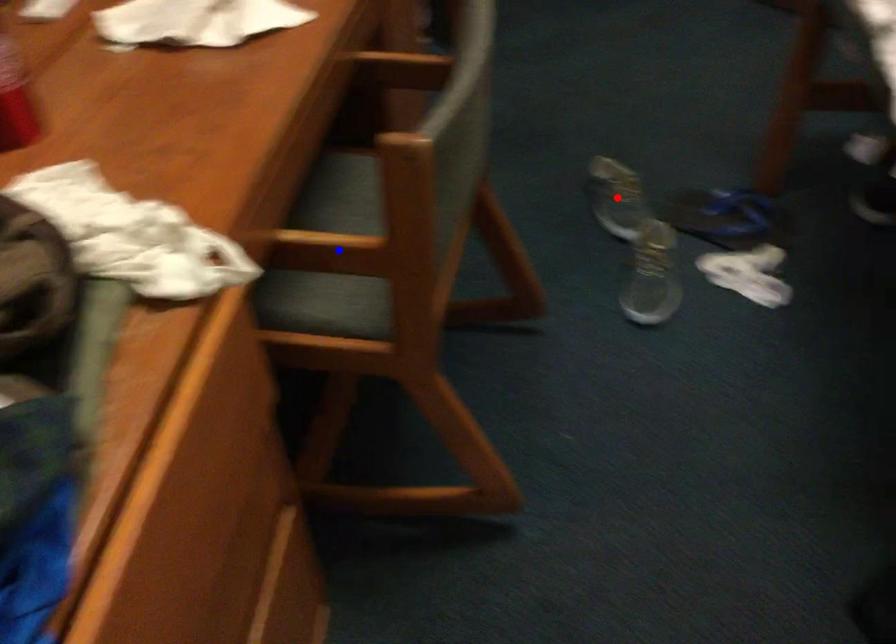
Question: Which of the two points in the image is closer to the camera?

Choices:
 (A) Blue point is closer.
 (B) Red point is closer.

Answer: (A)